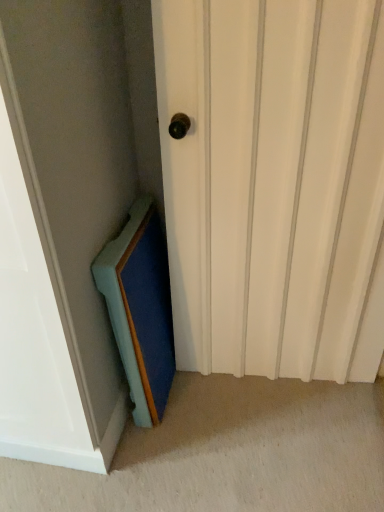
Question: In the image, is white matte door at center positioned in front of or behind teal wood medicine cabinet at lower left?

Choices:
 (A) behind
 (B) front

Answer: (B)

Question: Is white matte door at center wider or thinner than teal wood medicine cabinet at lower left?

Choices:
 (A) thin
 (B) wide

Answer: (B)

Question: Looking at the image, does white matte door at center seem bigger or smaller compared to teal wood medicine cabinet at lower left?

Choices:
 (A) small
 (B) big

Answer: (B)

Question: Is teal wood medicine cabinet at lower left wider or thinner than white matte door at center?

Choices:
 (A) thin
 (B) wide

Answer: (A)

Question: Based on their positions, is teal wood medicine cabinet at lower left located to the left or right of white matte door at center?

Choices:
 (A) right
 (B) left

Answer: (B)

Question: In terms of height, does teal wood medicine cabinet at lower left look taller or shorter compared to white matte door at center?

Choices:
 (A) tall
 (B) short

Answer: (B)

Question: From a real-world perspective, is teal wood medicine cabinet at lower left physically located above or below white matte door at center?

Choices:
 (A) above
 (B) below

Answer: (B)